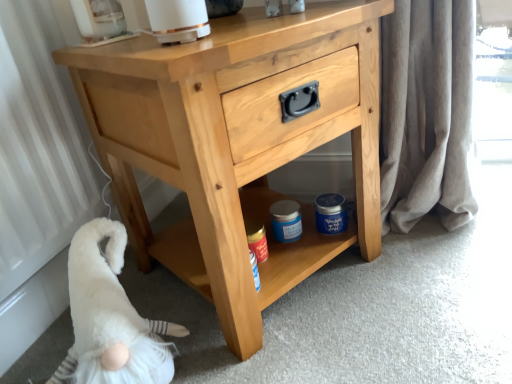
The image size is (512, 384). Identify the location of empty space that is to the right of light wood chest of drawers at center. (439, 265).